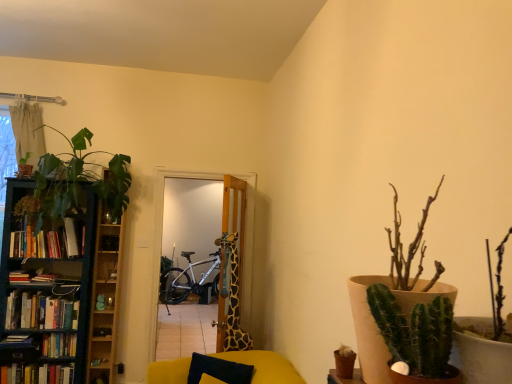
Question: From a real-world perspective, relative to hardcover books at left, the second book in the top-to-bottom sequence, is wooden cabinet at left vertically above or below?

Choices:
 (A) above
 (B) below

Answer: (A)

Question: From the image's perspective, is wooden cabinet at left positioned above or below hardcover books at left, the 4th book positioned from the bottom?

Choices:
 (A) below
 (B) above

Answer: (B)

Question: Based on their relative distances, which object is nearer to the hardcover books at left, marked as the first book in a bottom-to-top arrangement?

Choices:
 (A) green leafy plant at left, the 2th houseplant viewed from the right
 (B) teal wooden bookcase at left
 (C) green spiky cactus at right, which appears as the 1th houseplant when viewed from the front
 (D) hardcover book at left, the 3th book when ordered from bottom to top
 (E) velvety dark blue pillow at lower center

Answer: (D)

Question: Which object is the farthest from the hardcover book at left, positioned as the second book in bottom-to-top order?

Choices:
 (A) wooden cabinet at left
 (B) beige fabric curtain at upper left
 (C) hardcover books at left, the second book in the top-to-bottom sequence
 (D) hardcover books at left, marked as the first book in a bottom-to-top arrangement
 (E) green spiky cactus at right, the 1th houseplant when ordered from right to left

Answer: (E)